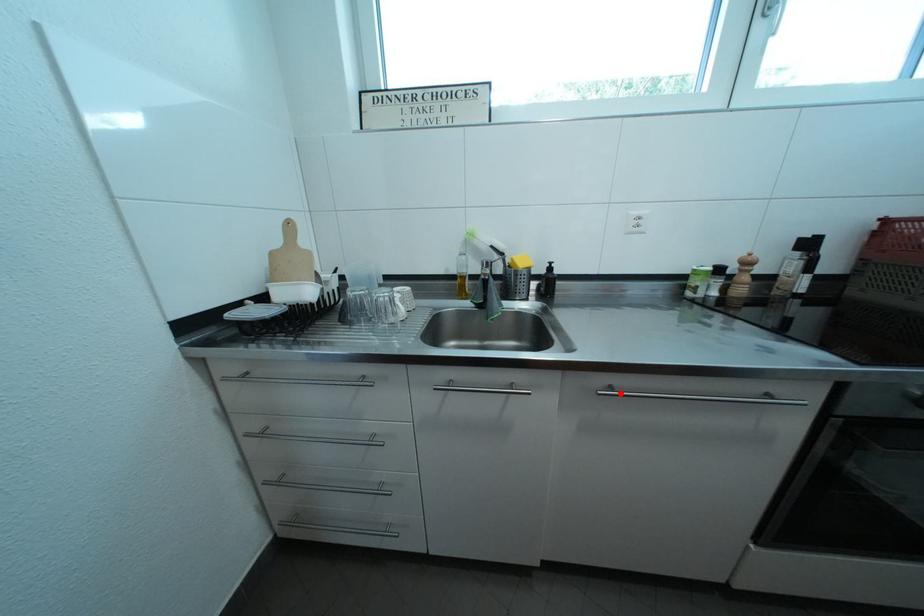
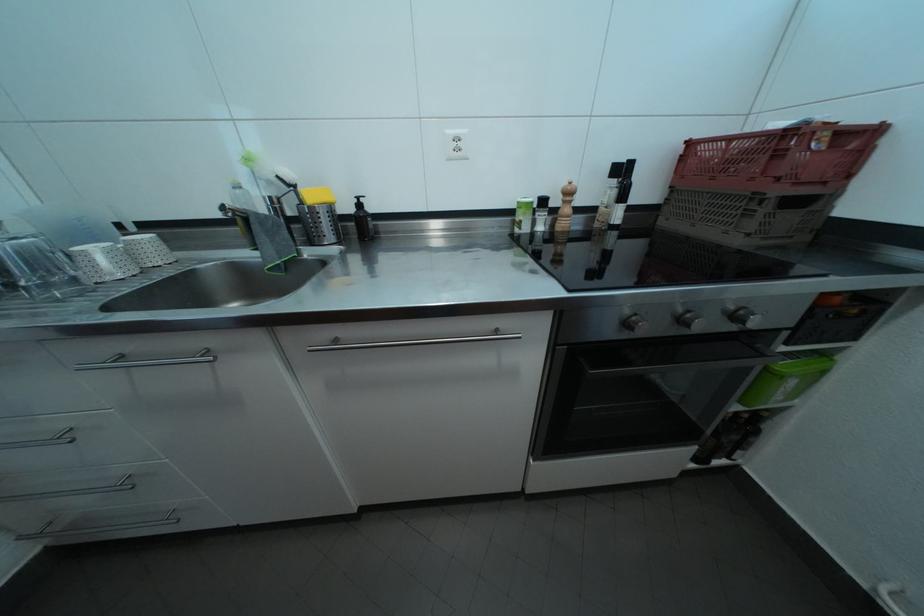
In the second image, find the point that corresponds to the highlighted location in the first image.

(346, 347)